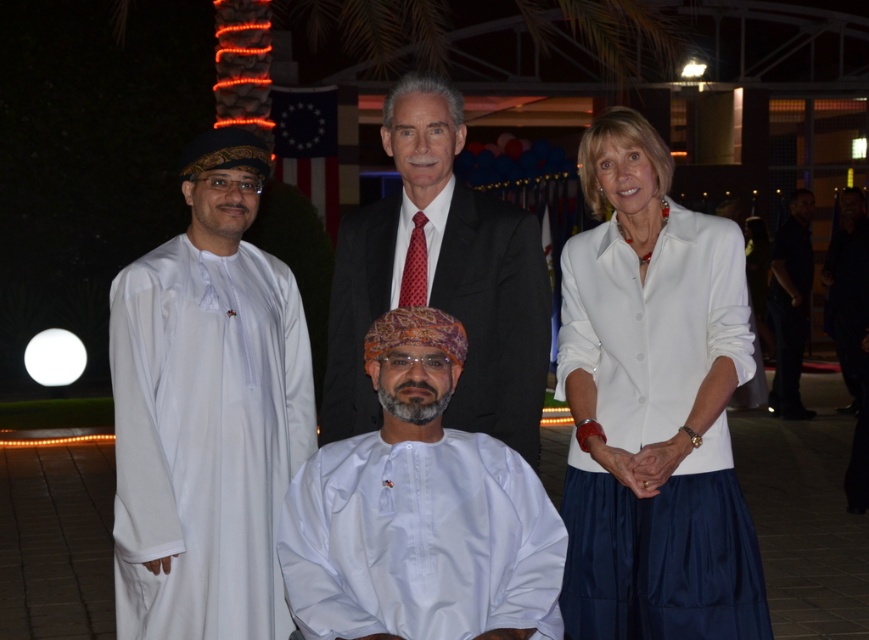
You are a photographer adjusting the lighting for a group photo. The subjects include a white satin shirt at center and a black smooth shirt at right. Which shirt requires more space between the photographer and the subject to avoid overcrowding?

The black smooth shirt at right requires more space because it has a greater width than the white satin shirt at center, necessitating more room to prevent overcrowding.

You are a photographer at an evening event with palm trees and decorative lights. You see a white cotton robe at left and a black smooth shirt at right. Which clothing item is positioned lower in the image?

The white cotton robe at left is positioned lower in the image as it is below the black smooth shirt at right.

In the scene shown: You are a photographer at the event and need to adjust the camera focus. Which of the two items, the white cotton robe at left or the black smooth shirt at right, requires you to focus closer because it is shorter?

The white cotton robe at left is shorter than the black smooth shirt at right, so you should focus closer on the white cotton robe at left.